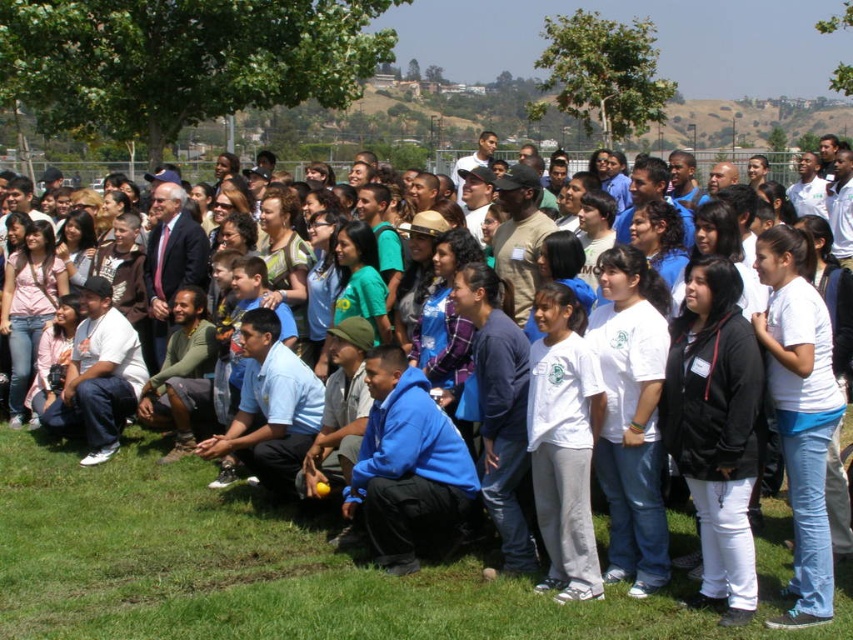
Question: Can you confirm if green grass at lower left is bigger than white matte t-shirt at center?

Choices:
 (A) yes
 (B) no

Answer: (B)

Question: Is green grass at lower left to the left of white matte t-shirt at center from the viewer's perspective?

Choices:
 (A) yes
 (B) no

Answer: (A)

Question: Does green grass at lower left have a larger size compared to white matte t-shirt at center?

Choices:
 (A) no
 (B) yes

Answer: (A)

Question: Which point is closer to the camera?

Choices:
 (A) (19, 540)
 (B) (566, 486)

Answer: (B)